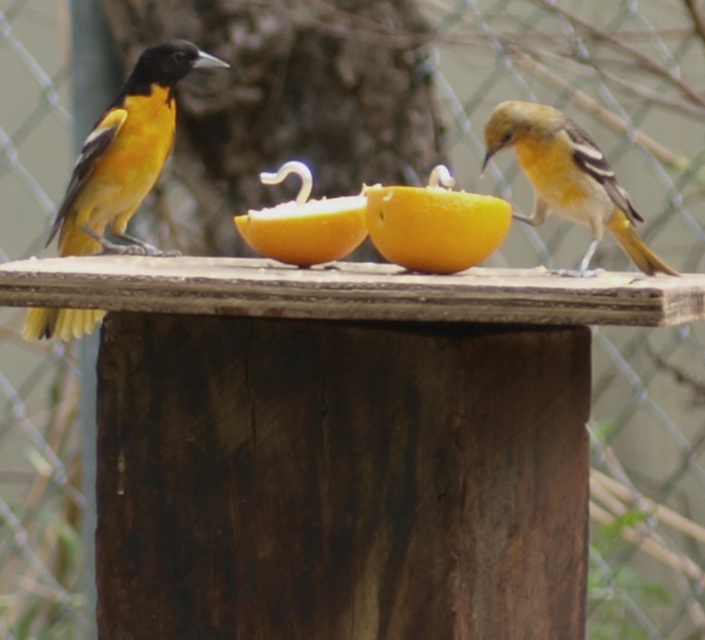
Question: Among these objects, which one is farthest from the camera?

Choices:
 (A) golden-yellow feathers at left
 (B) orange-yellow feathers at right
 (C) yellow matte/orange at center

Answer: (A)

Question: Which point is farther to the camera?

Choices:
 (A) golden-yellow feathers at left
 (B) yellow matte/orange at center
 (C) orange-yellow feathers at right

Answer: (A)

Question: Is orange-yellow feathers at right closer to the viewer compared to yellow matte/orange at center?

Choices:
 (A) no
 (B) yes

Answer: (A)

Question: In this image, where is golden-yellow feathers at left located relative to yellow matte/orange at center?

Choices:
 (A) left
 (B) right

Answer: (A)

Question: Which is nearer to the golden-yellow feathers at left?

Choices:
 (A) orange-yellow feathers at right
 (B) yellow matte/orange at center

Answer: (A)

Question: Is golden-yellow feathers at left to the right of orange-yellow feathers at right from the viewer's perspective?

Choices:
 (A) yes
 (B) no

Answer: (B)